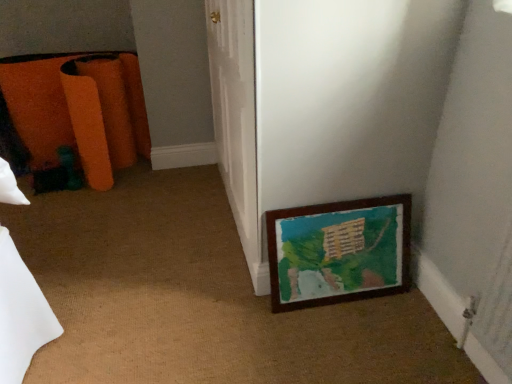
Find the location of a particular element. Image resolution: width=512 pixels, height=384 pixels. vacant space to the left of wooden picture frame at lower right is located at coordinates (240, 306).